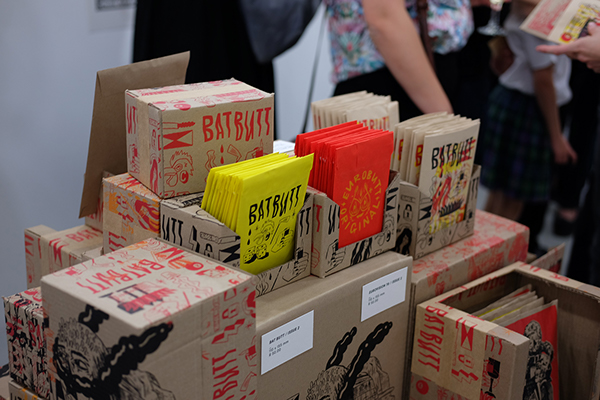
You are a GUI agent. You are given a task and a screenshot of the screen. Output one action in this format:
    pyautogui.click(x=<x>, y=<y>)
    Task: Click on the wall
    
    Given the screenshot: What is the action you would take?
    pyautogui.click(x=78, y=67)